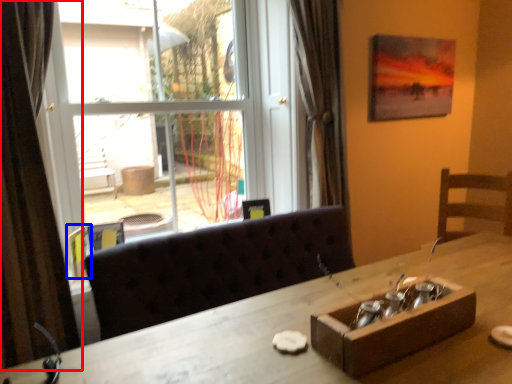
Question: Which point is further to the camera, curtain (highlighted by a red box) or picture frame (highlighted by a blue box)?

Choices:
 (A) curtain
 (B) picture frame

Answer: (B)